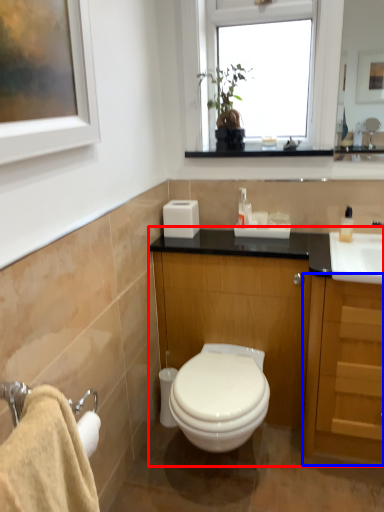
Question: Among these objects, which one is nearest to the camera, bathroom cabinet (highlighted by a red box) or cabinetry (highlighted by a blue box)?

Choices:
 (A) bathroom cabinet
 (B) cabinetry

Answer: (B)